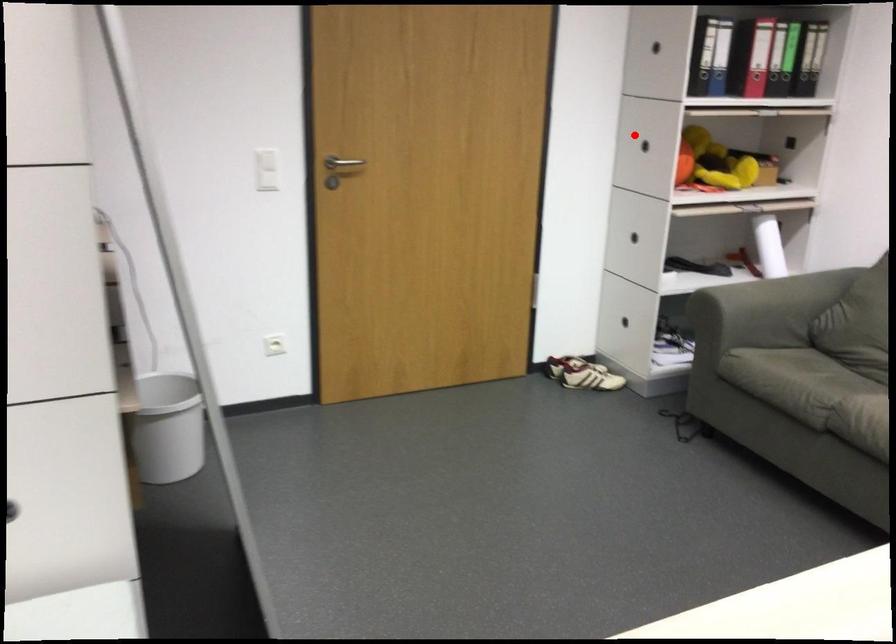
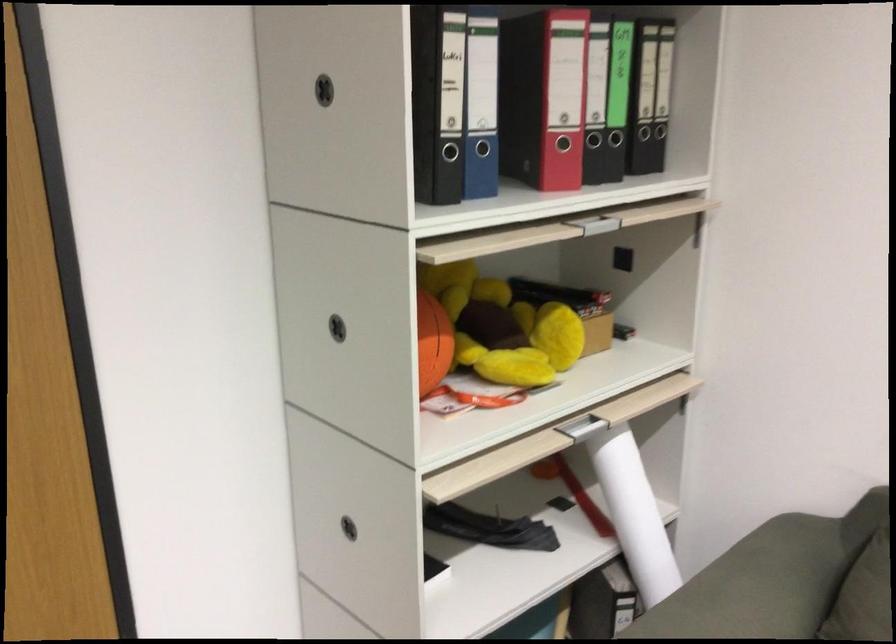
Where in the second image is the point corresponding to the highlighted location from the first image?

(337, 328)